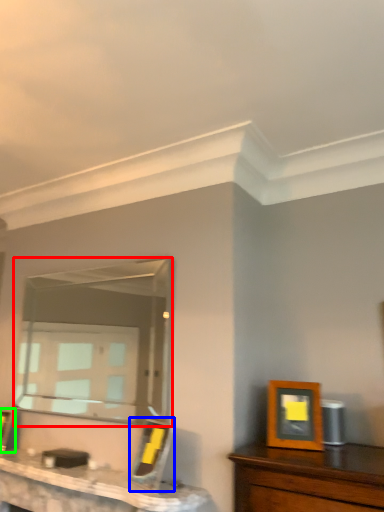
Question: Estimate the real-world distances between objects in this image. Which object is farther from mirror (highlighted by a red box), picture frame (highlighted by a blue box) or picture frame (highlighted by a green box)?

Choices:
 (A) picture frame
 (B) picture frame

Answer: (A)